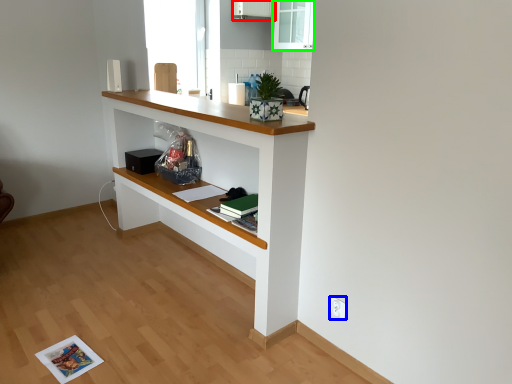
Question: Considering the real-world distances, which object is farthest from cabinetry (highlighted by a red box)? electric outlet (highlighted by a blue box) or glass door (highlighted by a green box)?

Choices:
 (A) electric outlet
 (B) glass door

Answer: (A)